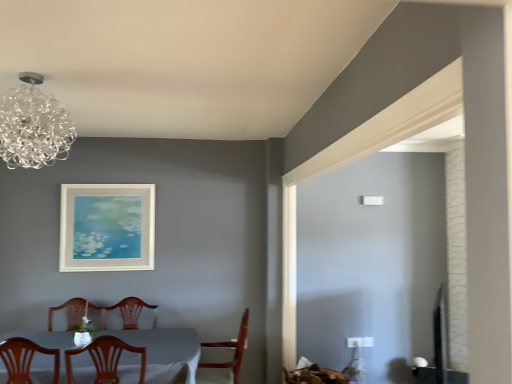
Question: Is wooden chair at center, the 1th chair when ordered from left to right, inside the boundaries of white glossy table at lower left, or outside?

Choices:
 (A) outside
 (B) inside

Answer: (B)

Question: Is wooden chair at center, the 1th chair positioned from the front, taller or shorter than white glossy table at lower left?

Choices:
 (A) tall
 (B) short

Answer: (B)

Question: Estimate the real-world distances between objects in this image. Which object is closer to the white matte picture frame at upper center?

Choices:
 (A) wooden chair at center, acting as the 2th chair starting from the left
 (B) wooden chair at center, marked as the 2th chair in a right-to-left arrangement
 (C) white glossy table at lower left
 (D) transparent glass chandelier at upper left

Answer: (C)

Question: Considering the real-world distances, which object is farthest from the white matte picture frame at upper center?

Choices:
 (A) transparent glass chandelier at upper left
 (B) wooden chair at center, placed as the first chair when sorted from right to left
 (C) white glossy table at lower left
 (D) wooden chair at center, marked as the 2th chair in a right-to-left arrangement

Answer: (A)